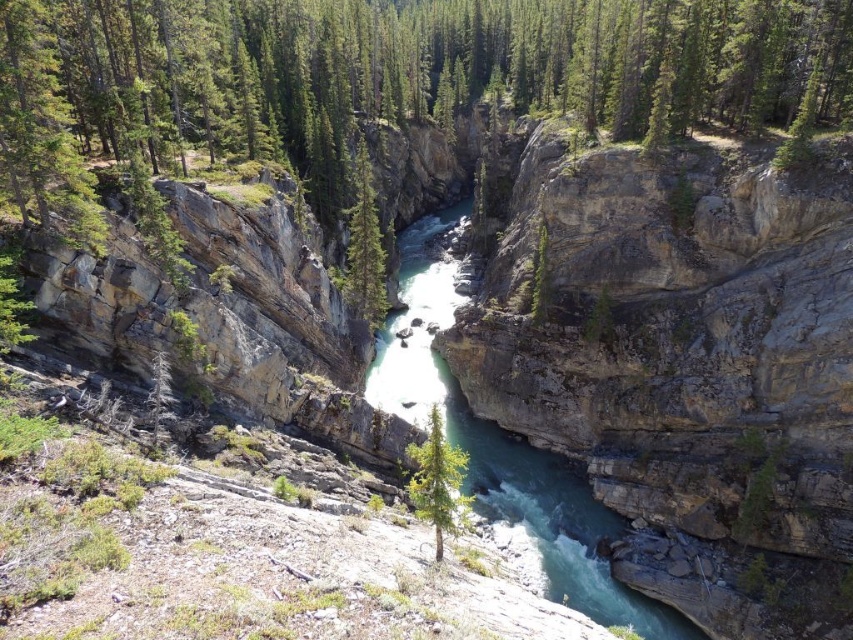
You are a hiker standing at the edge of the canyon looking towards the center. You see both the green matte tree at center and the green textured tree at center. Which tree is closer to your viewpoint?

The green matte tree at center is below the green textured tree at center, meaning the green textured tree at center is closer to your viewpoint.

You are a hiker standing at the edge of the canyon. You notice the turquoise smooth river at center. Based on its position, can you determine if it flows to the left or right side of the canyon?

The turquoise smooth river at center is located at point coordinates, but without additional directional context or flow indicators in the scene description, it is impossible to determine the direction of the river flow. The scene description mentions the river meanders through the narrow gorge but does not specify the direction.

You are a hiker planning to cross the canyon. You see the turquoise smooth river at center and the green textured tree at center. Which one would you need to navigate around if you want to take the shortest path?

The turquoise smooth river at center is bigger than the green textured tree at center, so you would need to navigate around the turquoise smooth river at center to take the shortest path.